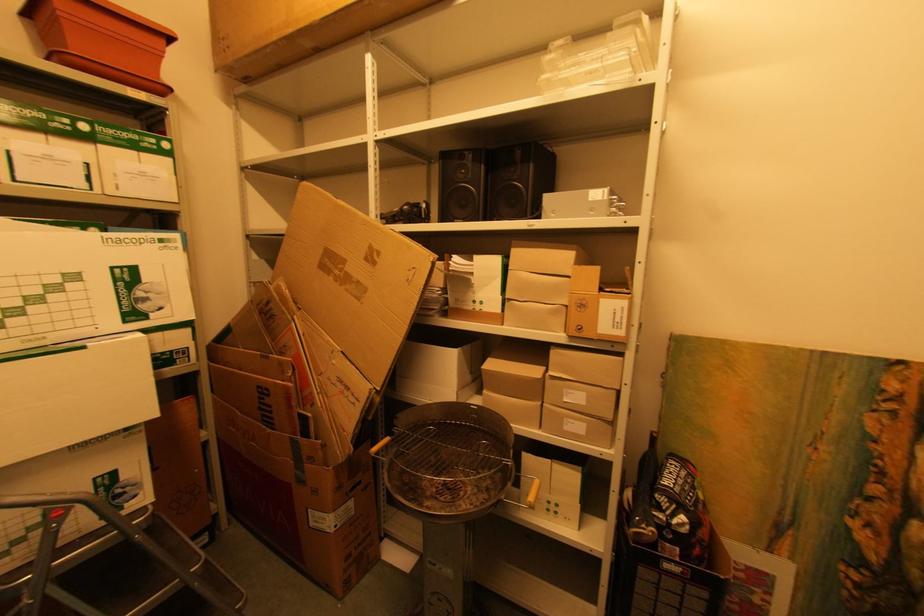
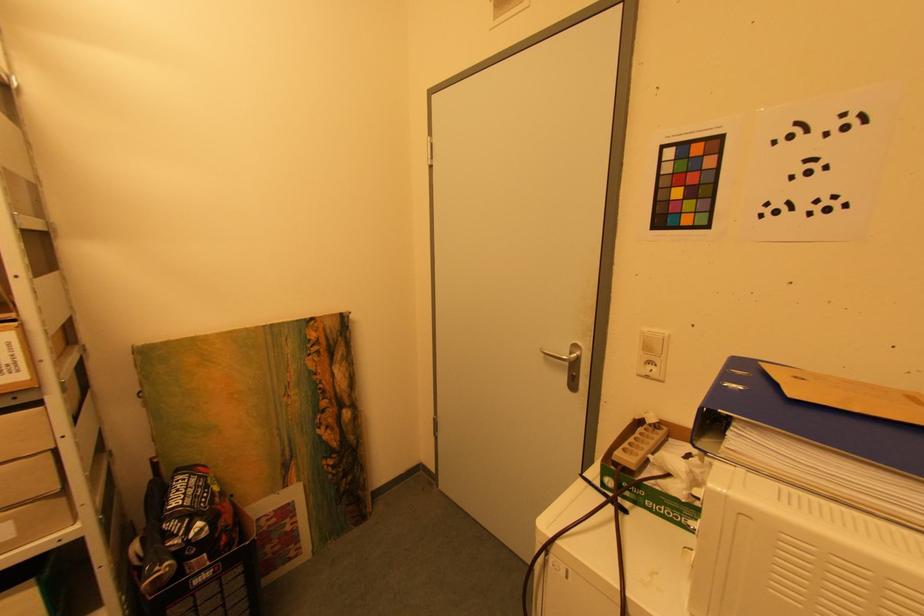
Question: The images are taken continuously from a first-person perspective. In which direction is your viewpoint rotating?

Choices:
 (A) Left
 (B) Right
 (C) Up
 (D) Down

Answer: (B)